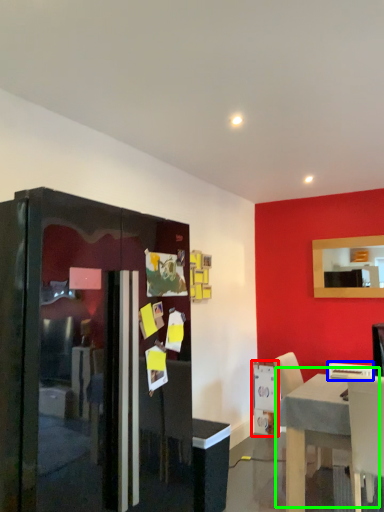
Question: Estimate the real-world distances between objects in this image. Which object is closer to appliance (highlighted by a red box), chair (highlighted by a blue box) or table (highlighted by a green box)?

Choices:
 (A) chair
 (B) table

Answer: (A)